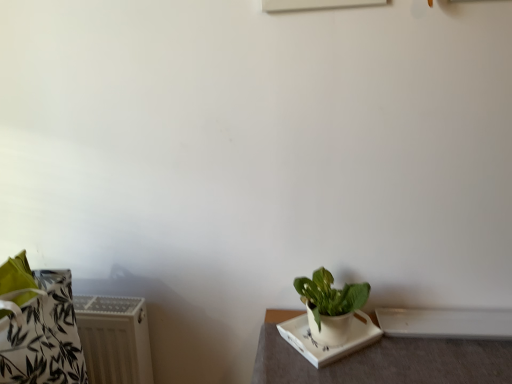
Question: Considering the relative positions of white glossy window sill at lower right and white ceramic tray at lower right in the image provided, is white glossy window sill at lower right to the left or to the right of white ceramic tray at lower right?

Choices:
 (A) left
 (B) right

Answer: (B)

Question: From the image's perspective, is white glossy window sill at lower right located above or below white ceramic tray at lower right?

Choices:
 (A) above
 (B) below

Answer: (A)

Question: Estimate the real-world distances between objects in this image. Which object is closer to the white ceramic plate at lower right?

Choices:
 (A) white ceramic tray at lower right
 (B) white textured radiator at lower left
 (C) green matte plant at lower right
 (D) white glossy window sill at lower right

Answer: (C)

Question: Estimate the real-world distances between objects in this image. Which object is farther from the green matte plant at lower right?

Choices:
 (A) white ceramic tray at lower right
 (B) white textured radiator at lower left
 (C) white glossy window sill at lower right
 (D) white ceramic plate at lower right

Answer: (B)